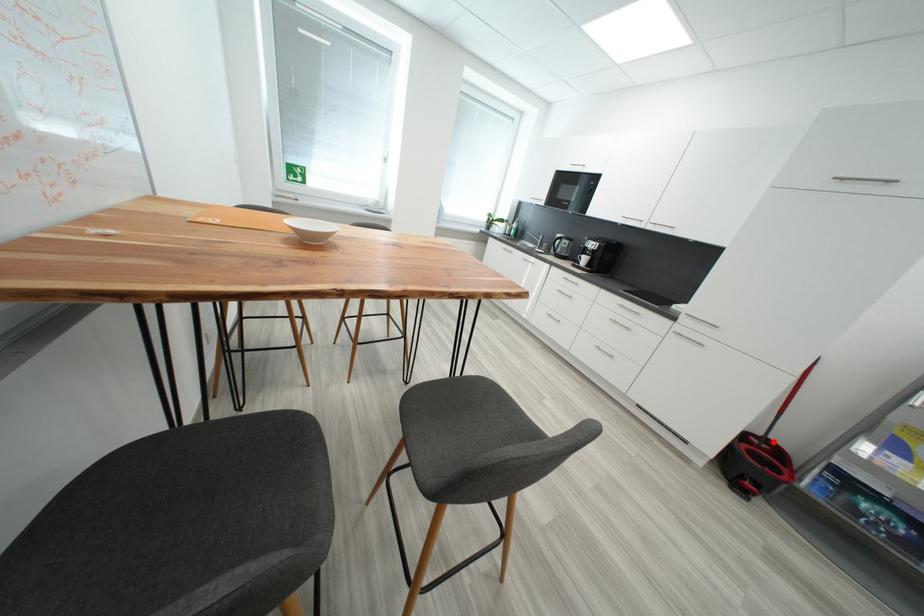
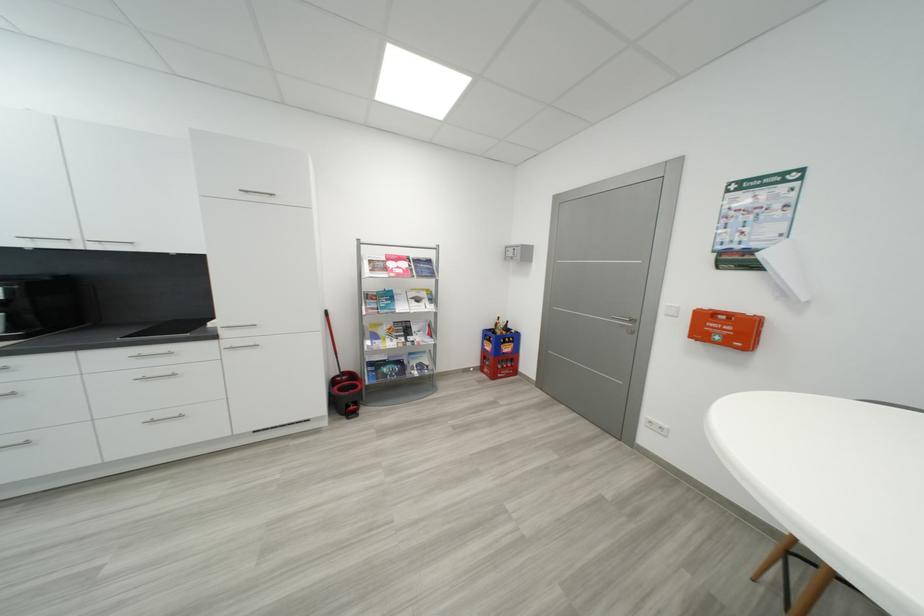
The point at the highlighted location is marked in the first image. Where is the corresponding point in the second image?

(350, 375)